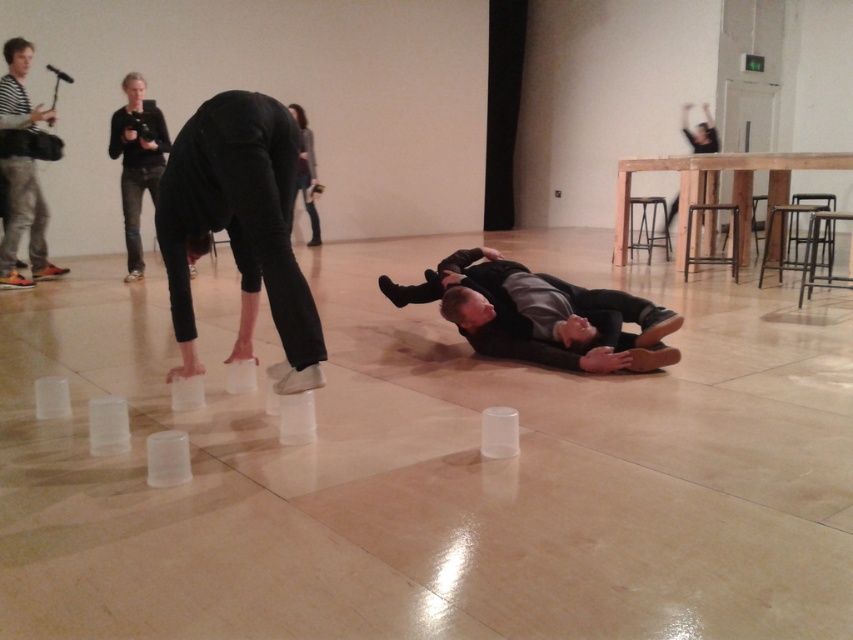
Which is behind, point (39, 112) or point (843, 284)?

The point (843, 284) is behind.

Is striped cotton shirt at upper left to the right of wooden stool at center right from the viewer's perspective?

In fact, striped cotton shirt at upper left is to the left of wooden stool at center right.

Does point (15, 104) lie in front of point (822, 230)?

That is True.

You are a GUI agent. You are given a task and a screenshot of the screen. Output one action in this format:
    pyautogui.click(x=<x>, y=<y>)
    Task: Click on the striped cotton shirt at upper left
    Image resolution: width=853 pixels, height=640 pixels.
    Given the screenshot: What is the action you would take?
    pyautogui.click(x=22, y=170)

Is the position of metallic silver stool at right less distant than that of dark gray sweater at upper center?

That is True.

Is point (790, 204) positioned before point (300, 182)?

Yes, point (790, 204) is in front of point (300, 182).

You are a GUI agent. You are given a task and a screenshot of the screen. Output one action in this format:
    pyautogui.click(x=<x>, y=<y>)
    Task: Click on the metallic silver stool at right
    The image size is (853, 640).
    Given the screenshot: What is the action you would take?
    pyautogui.click(x=785, y=237)

Between black fabric camera at upper left and black matte stool at upper right, which one appears on the right side from the viewer's perspective?

black matte stool at upper right

Which is more to the left, black fabric camera at upper left or black matte stool at upper right?

black fabric camera at upper left is more to the left.

The image size is (853, 640). Find the location of `black fabric camera at upper left`. black fabric camera at upper left is located at coordinates (137, 161).